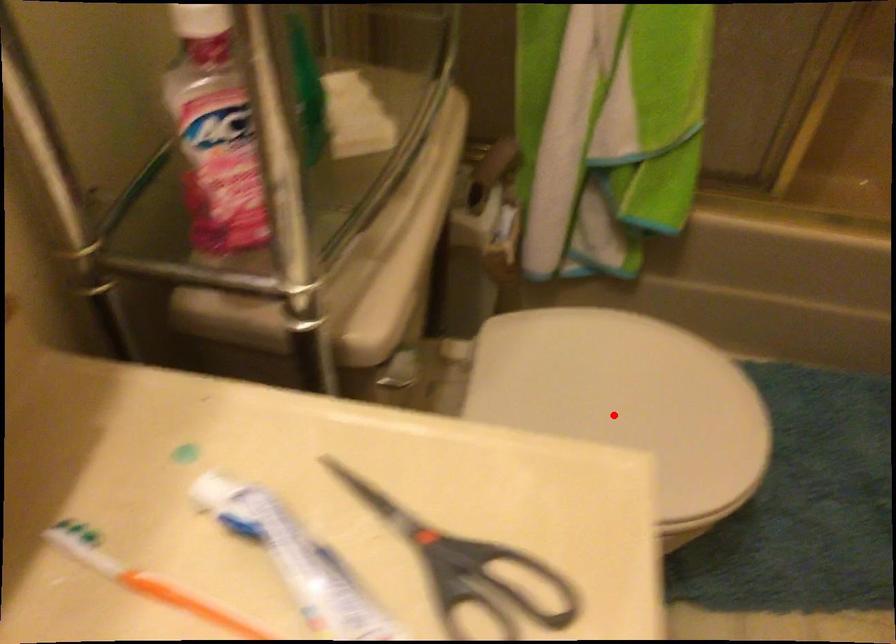
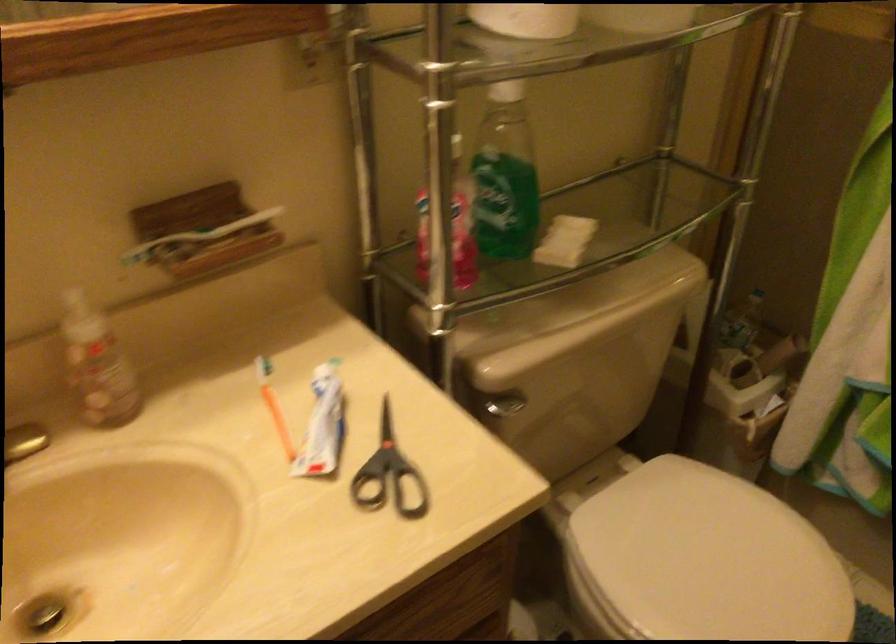
Question: I am providing you with two images of the same scene from different viewpoints. In image1, a red point is highlighted. Considering the same 3D point in image2, which of the following is correct?

Choices:
 (A) It is closer
 (B) It is farther

Answer: (B)